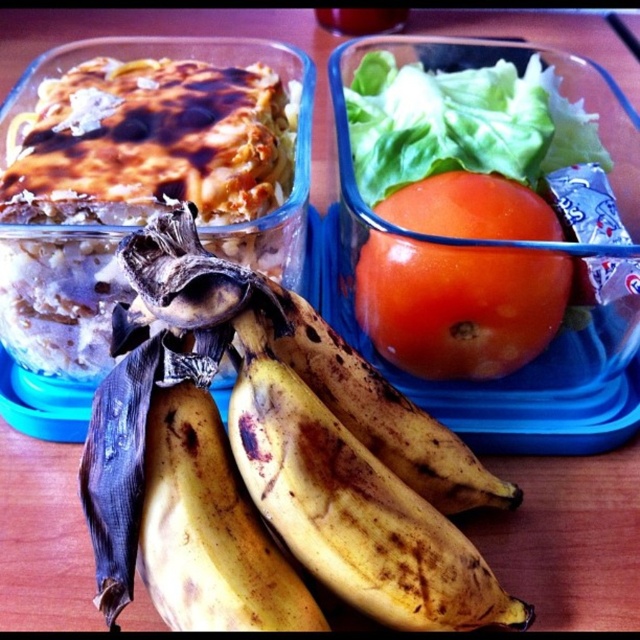
You are packing a lunchbox and want to place the ripe yellow banana at lower left and the green leafy lettuce at upper center in your bag. Which item should you place first if you want to fit both items into a narrow compartment?

You should place the ripe yellow banana at lower left first because it is thinner than the green leafy lettuce at upper center, allowing more space for the lettuce afterward.